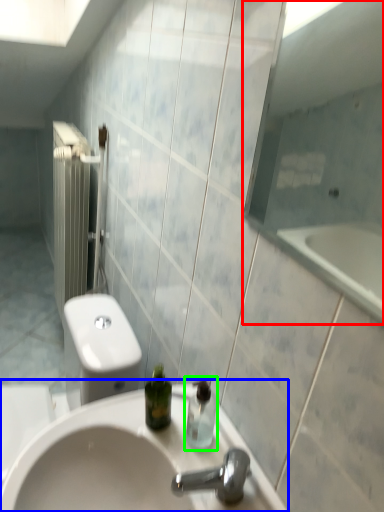
Question: Which is nearer to the mirror (highlighted by a red box)? sink (highlighted by a blue box) or soap dispenser (highlighted by a green box).

Choices:
 (A) sink
 (B) soap dispenser

Answer: (A)